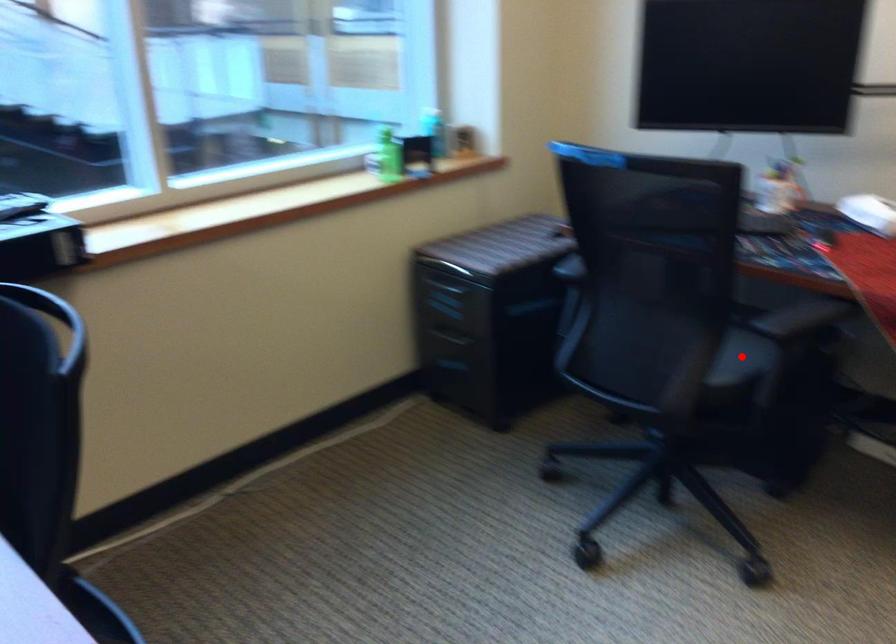
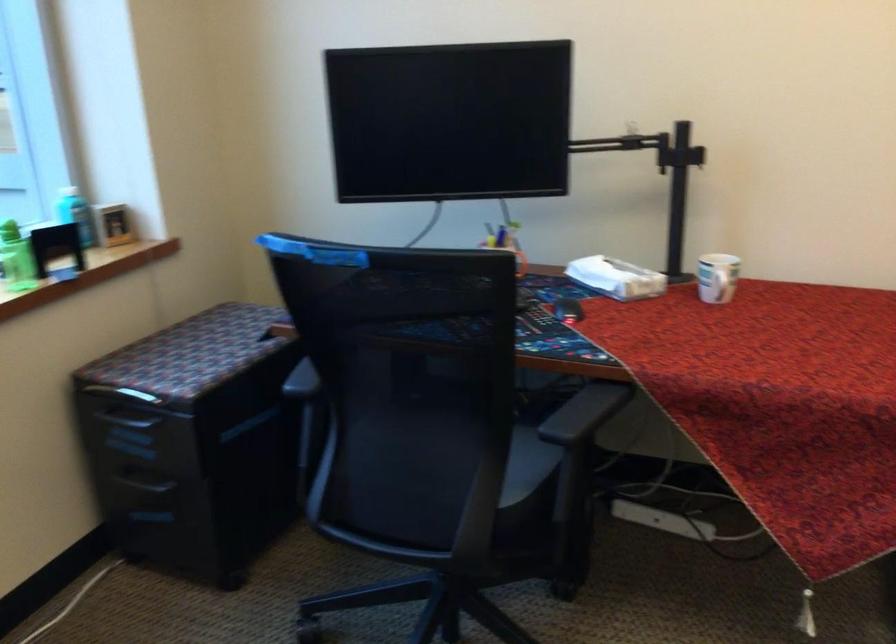
The point at the highlighted location is marked in the first image. Where is the corresponding point in the second image?

(527, 465)